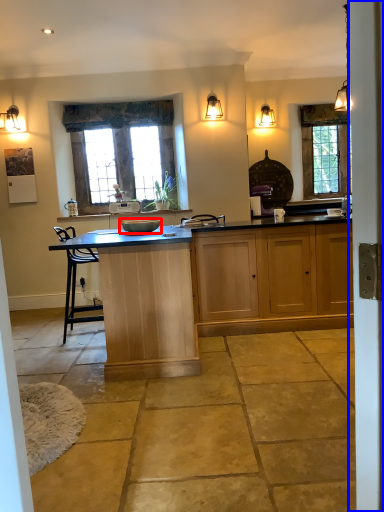
Question: Among these objects, which one is farthest to the camera, sink (highlighted by a red box) or screen door (highlighted by a blue box)?

Choices:
 (A) sink
 (B) screen door

Answer: (A)